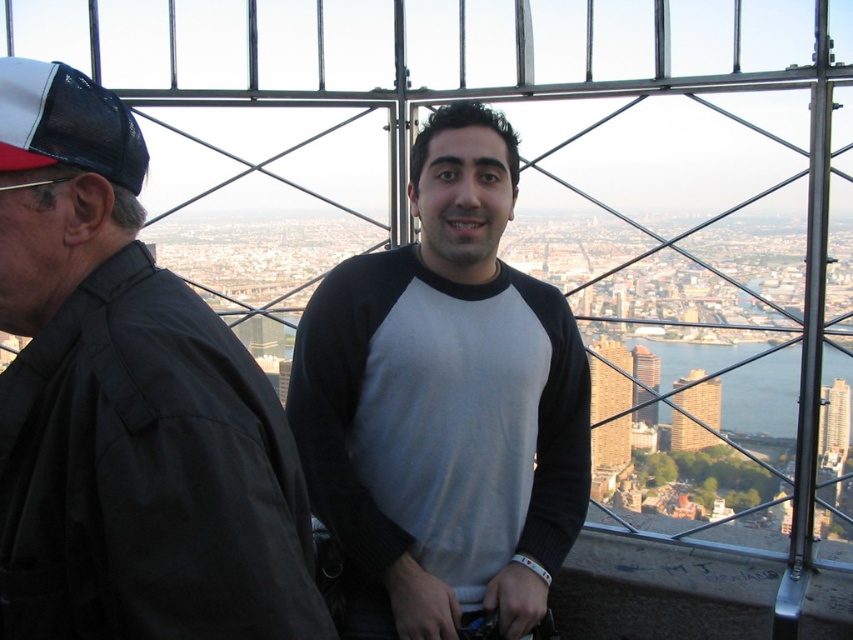
Question: Which object is positioned farthest from the glassy reflective skyscraper at center?

Choices:
 (A) white mesh baseball cap at left
 (B) brown brick building at center
 (C) dark gray shirt at left
 (D) gray/black raglan shirt at center

Answer: (A)

Question: Which is nearer to the gray/black raglan shirt at center?

Choices:
 (A) brown brick building at center
 (B) glassy reflective skyscraper at center
 (C) white mesh baseball cap at left
 (D) dark gray shirt at left

Answer: (A)

Question: Considering the relative positions of dark gray shirt at left and brown brick building at center in the image provided, where is dark gray shirt at left located with respect to brown brick building at center?

Choices:
 (A) above
 (B) below

Answer: (A)

Question: Which point appears closest to the camera in this image?

Choices:
 (A) (141, 268)
 (B) (402, 605)
 (C) (672, 417)
 (D) (64, 104)

Answer: (D)

Question: Is brown brick building at center behind glassy reflective skyscraper at center?

Choices:
 (A) yes
 (B) no

Answer: (B)

Question: Does dark gray shirt at left have a lesser width compared to gray/black raglan shirt at center?

Choices:
 (A) no
 (B) yes

Answer: (A)